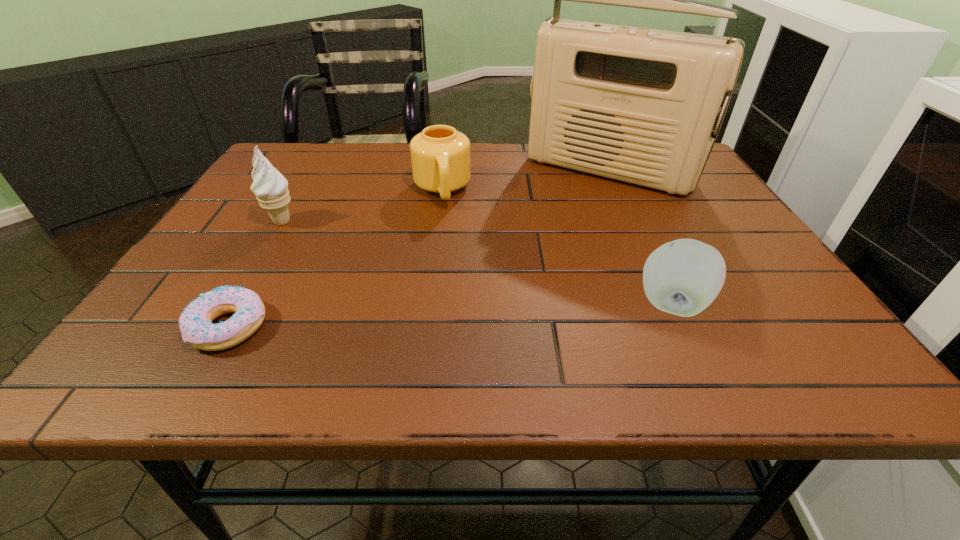
Image resolution: width=960 pixels, height=540 pixels. In order to click on vacant spot on the desktop that is between the doughnut and the apple and is positioned on the front-facing side of the icecream in this screenshot , I will do click(439, 317).

Where is `vacant space on the desktop that is between the shortest object and the apple and is positioned on the handle side of the mug`? vacant space on the desktop that is between the shortest object and the apple and is positioned on the handle side of the mug is located at coordinates (462, 316).

You are a GUI agent. You are given a task and a screenshot of the screen. Output one action in this format:
    pyautogui.click(x=<x>, y=<y>)
    Task: Click on the free spot on the desktop that is between the doughnut and the apple and is positioned on the front-facing side of the tallest object
    Image resolution: width=960 pixels, height=540 pixels.
    Given the screenshot: What is the action you would take?
    pyautogui.click(x=514, y=313)